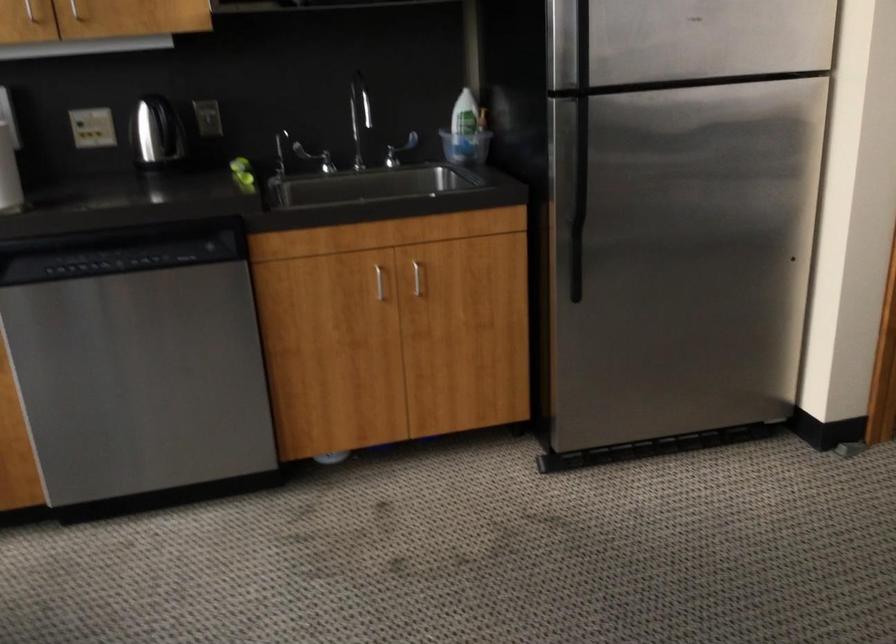
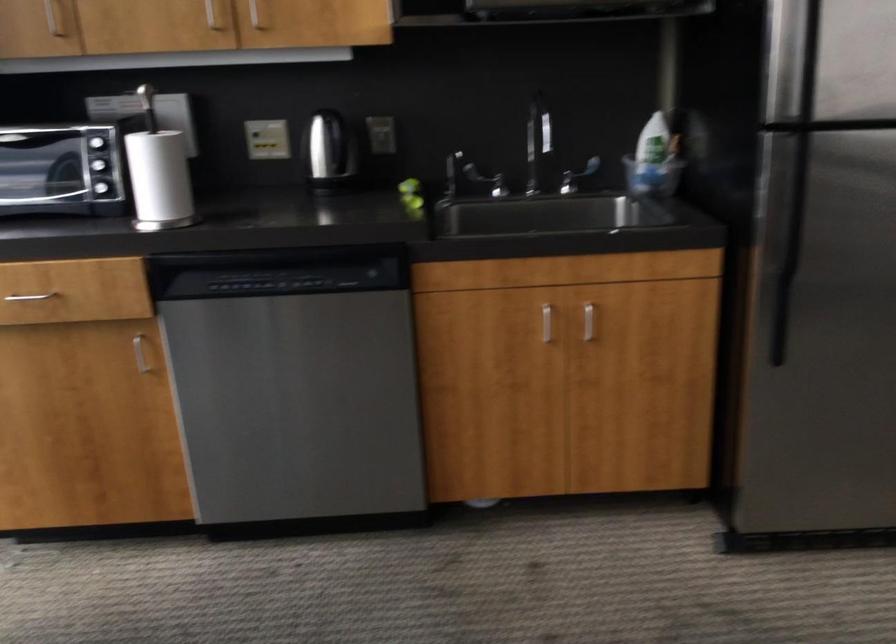
The point at (394, 149) is marked in the first image. Where is the corresponding point in the second image?

(576, 176)